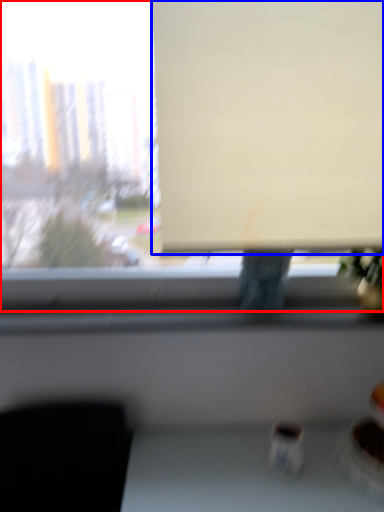
Question: Which object appears closest to the camera in this image, window (highlighted by a red box) or projection screen (highlighted by a blue box)?

Choices:
 (A) window
 (B) projection screen

Answer: (A)